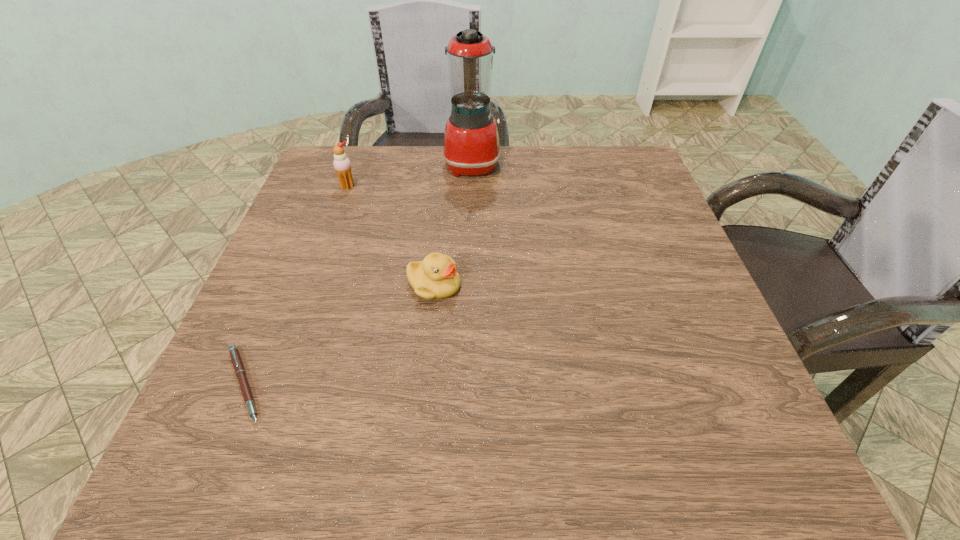
Locate an element on the screen. The width and height of the screenshot is (960, 540). vacant point located between the food processor and the second nearest object is located at coordinates (453, 225).

Where is `empty location between the shortest object and the icecream`? empty location between the shortest object and the icecream is located at coordinates (296, 286).

The height and width of the screenshot is (540, 960). I want to click on free spot between the second tallest object and the shortest object, so click(x=296, y=286).

Locate an element on the screen. The image size is (960, 540). vacant space in between the icecream and the third farthest object is located at coordinates (391, 236).

At what (x,y) coordinates should I click in order to perform the action: click on free space between the farthest object and the second nearest object. Please return your answer as a coordinate pair (x, y). The image size is (960, 540). Looking at the image, I should click on (453, 225).

Locate which object ranks in proximity to the tallest object. Please provide its 2D coordinates. Your answer should be formatted as a tuple, i.e. [(x, y)], where the tuple contains the x and y coordinates of a point satisfying the conditions above.

[(342, 165)]

Locate which object is the third closest to the second farthest object. Please provide its 2D coordinates. Your answer should be formatted as a tuple, i.e. [(x, y)], where the tuple contains the x and y coordinates of a point satisfying the conditions above.

[(237, 363)]

Find the location of a particular element. free space that satisfies the following two spatial constraints: 1. at the front with a straw on the second tallest object; 2. at the nib of the shortest object is located at coordinates (276, 384).

This screenshot has height=540, width=960. I want to click on vacant space that satisfies the following two spatial constraints: 1. on the controls of the tallest object; 2. at the front with a straw on the icecream, so click(471, 187).

Locate an element on the screen. This screenshot has width=960, height=540. free spot that satisfies the following two spatial constraints: 1. at the front with a straw on the third shortest object; 2. at the nib of the nearest object is located at coordinates (276, 384).